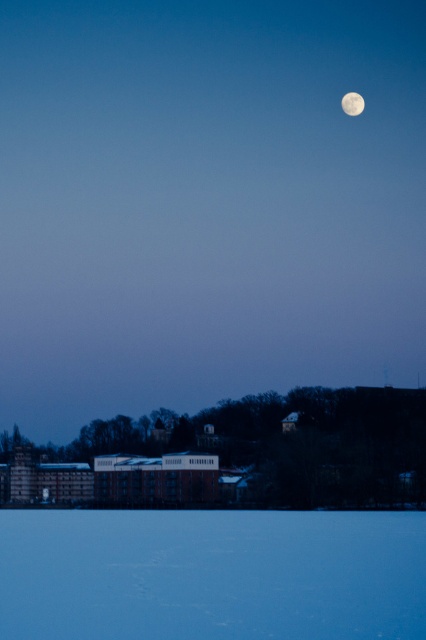
Is point (310, 64) farther from camera compared to point (359, 104)?

That is True.

Which is above, white glossy moon at upper right or white smooth moon at upper center?

white smooth moon at upper center is above.

Describe the element at coordinates (207, 202) in the screenshot. I see `white glossy moon at upper right` at that location.

Find the location of a particular element. white glossy moon at upper right is located at coordinates (207, 202).